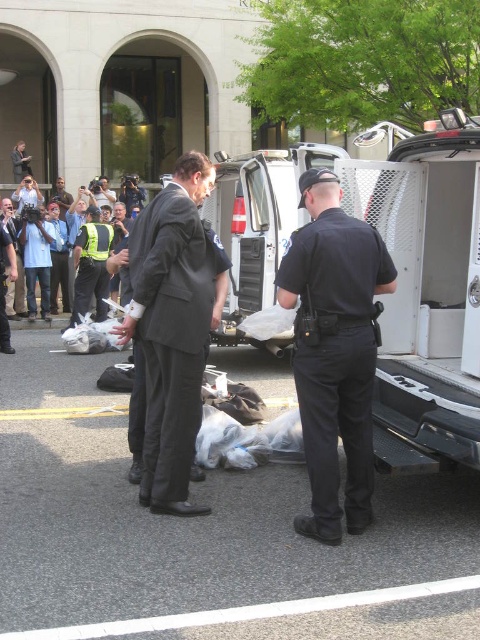
You are a bystander observing the scene. There are two people at the center wearing a black uniform at center and a reflective yellow vest at center. Which one is standing to the right?

The black uniform at center is positioned on the right side of reflective yellow vest at center, so the black uniform at center is standing to the right.

You are a police officer standing at the scene. You need to determine if a drone can fly over the point at coordinates point (314, 193) without being obstructed by any nearby objects. The drone has a minimum required altitude of 4 meters to avoid obstacles. What is the minimum altitude the drone should maintain to safely pass over the point?

The distance of point (314, 193) from the camera is 3.68 meters. Since the drone requires a minimum altitude of 4 meters to avoid obstacles, the drone should maintain an altitude of at least 4 meters to safely pass over the point.

Looking at this image, you are a photographer trying to capture a clear shot of the black uniform at center and the multicolored fabric crowd at left. Which object is narrower in width?

The black uniform at center has a lesser width compared to the multicolored fabric crowd at left, so the black uniform at center is narrower in width.